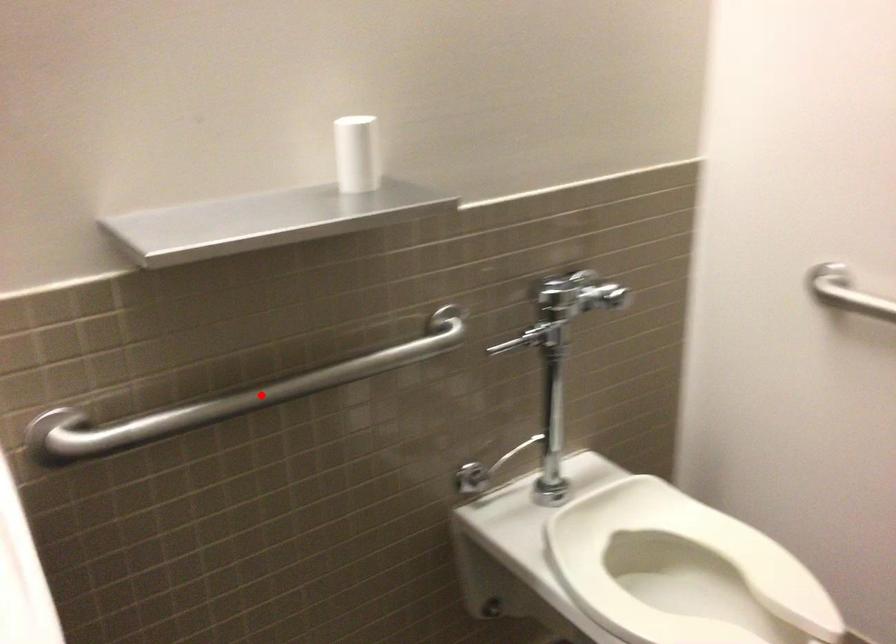
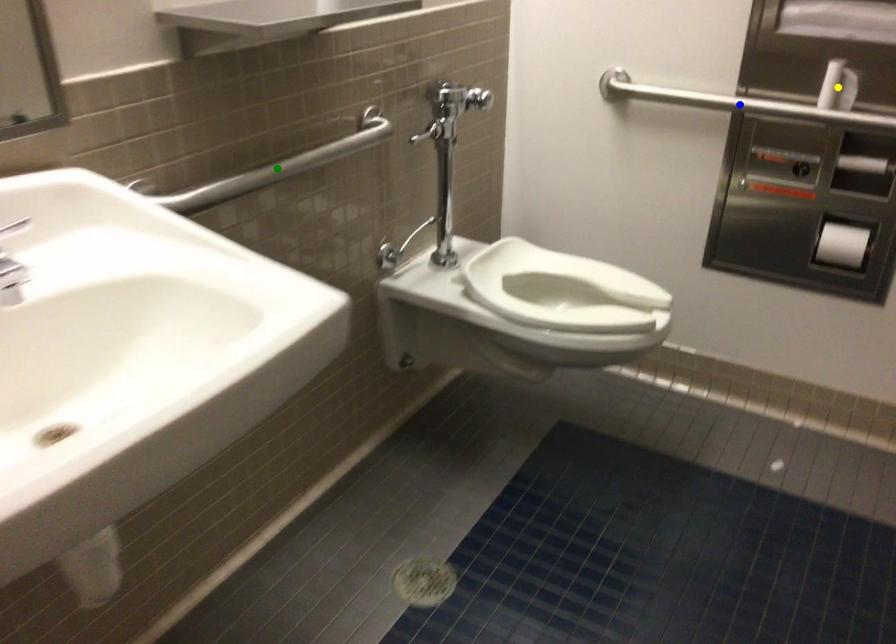
Question: I am providing you with two images of the same scene from different viewpoints. A red point is marked on the first image. You are given multiple points on the second image. Which spot in image 2 lines up with the point in image 1?

Choices:
 (A) blue point
 (B) yellow point
 (C) green point

Answer: (C)